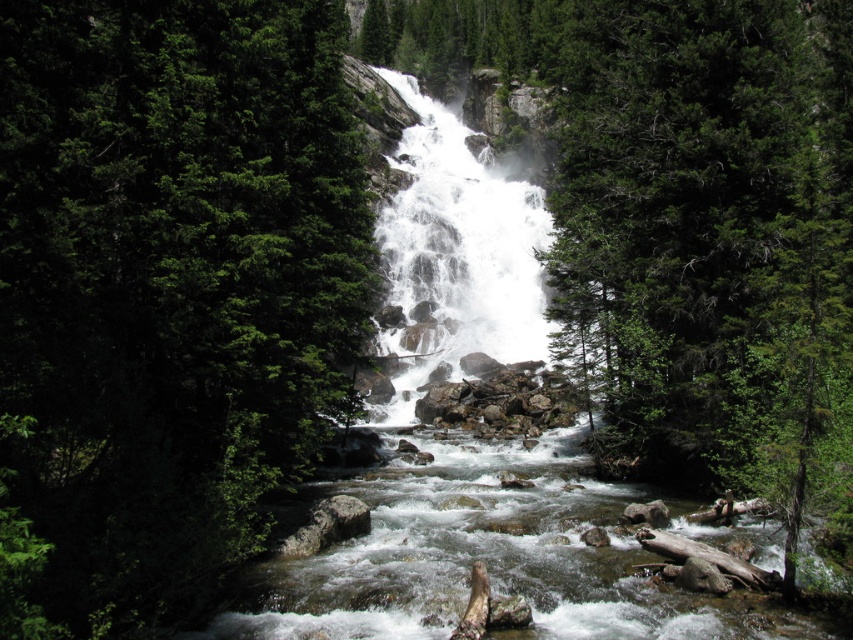
Does green leafy tree at center appear under green textured tree at center?

No.

Between green leafy tree at center and green textured tree at center, which one is positioned higher?

green leafy tree at center

Between point (306, 28) and point (813, 291), which one is positioned behind?

The point (306, 28) is more distant.

You are a GUI agent. You are given a task and a screenshot of the screen. Output one action in this format:
    pyautogui.click(x=<x>, y=<y>)
    Task: Click on the green leafy tree at center
    
    Given the screenshot: What is the action you would take?
    pyautogui.click(x=166, y=292)